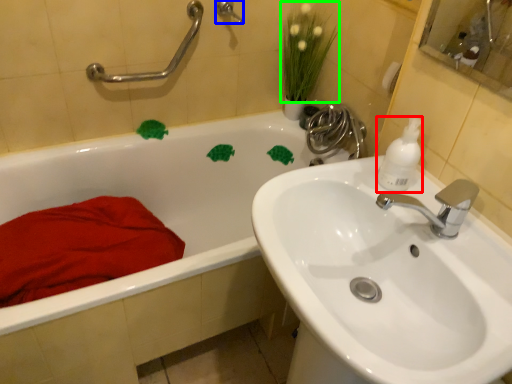
Question: Estimate the real-world distances between objects in this image. Which object is farther from cleaning product (highlighted by a red box), shower (highlighted by a blue box) or plant (highlighted by a green box)?

Choices:
 (A) shower
 (B) plant

Answer: (A)